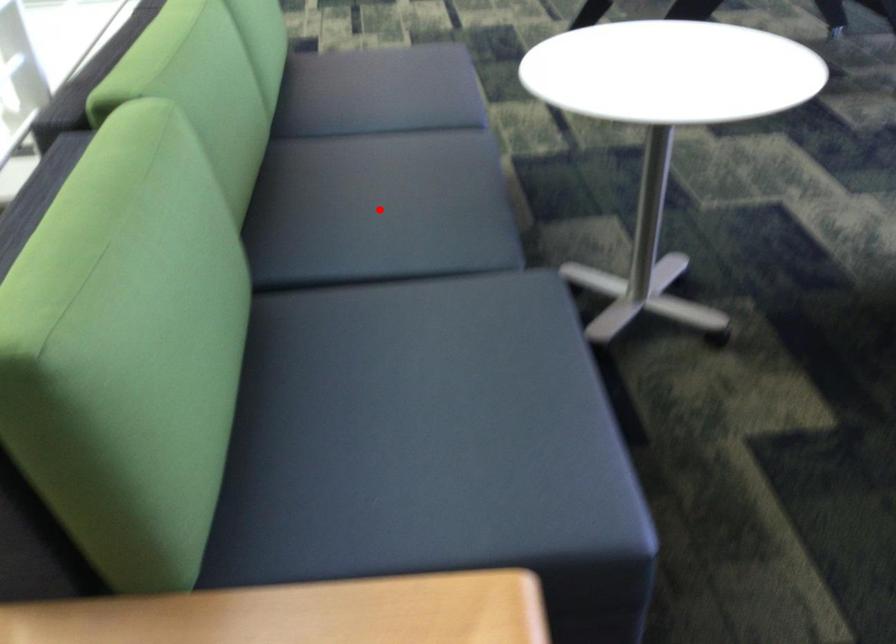
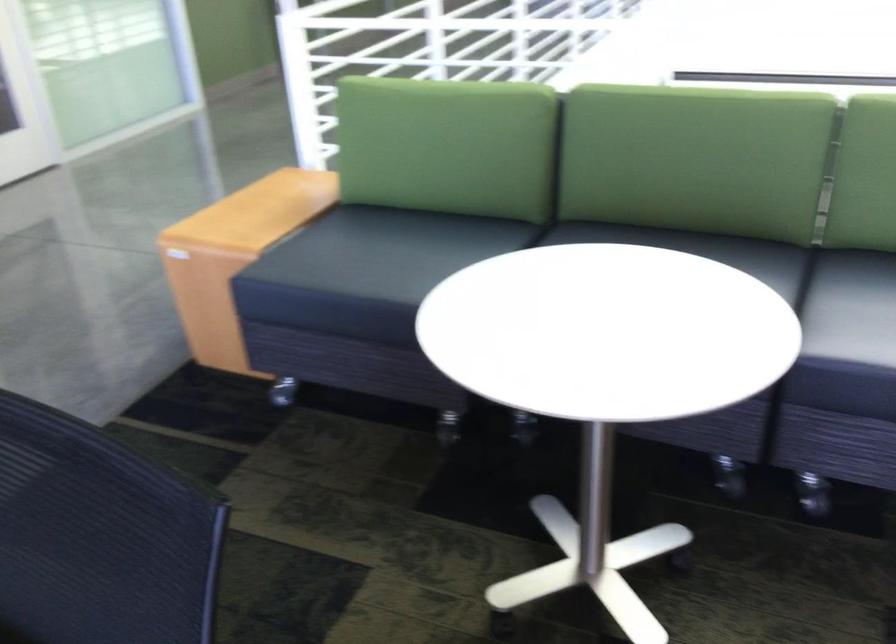
Question: I am providing you with two images of the same scene from different viewpoints. A red point is marked on the first image. At the location where the point appears in image 1, is it still visible in image 2?

Choices:
 (A) Yes
 (B) No

Answer: (B)